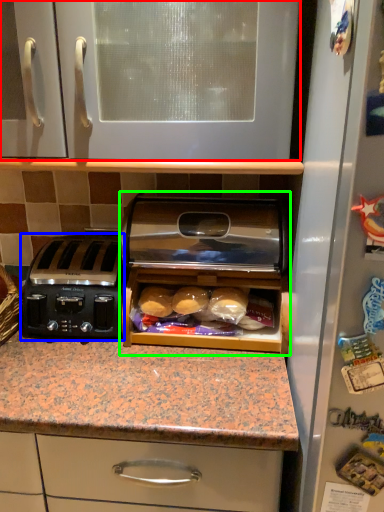
Question: Which object is positioned closest to cabinetry (highlighted by a red box)? Select from toaster (highlighted by a blue box) and home appliance (highlighted by a green box).

Choices:
 (A) toaster
 (B) home appliance

Answer: (B)